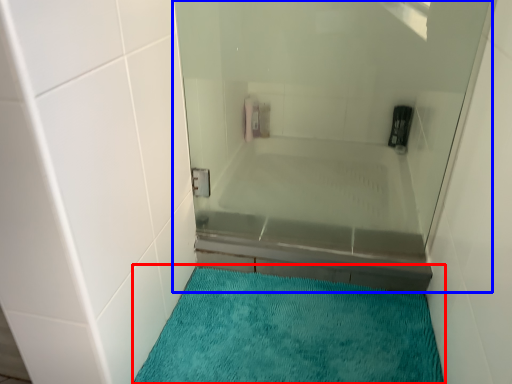
Question: Which object is closer to the camera taking this photo, bath mat (highlighted by a red box) or shower door (highlighted by a blue box)?

Choices:
 (A) bath mat
 (B) shower door

Answer: (A)